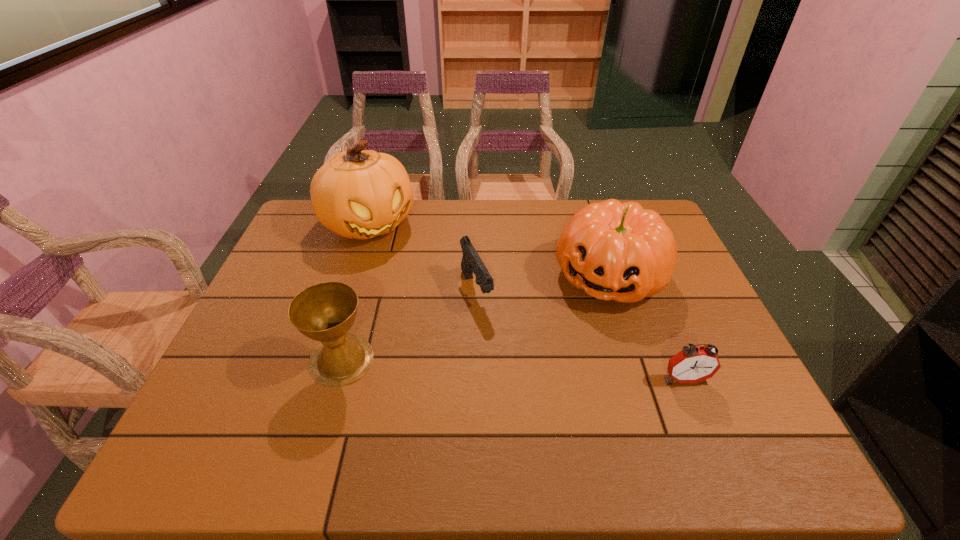
This screenshot has width=960, height=540. Identify the location of free space on the desktop that is between the third shortest object and the alarm clock and is positioned on the front face of the left pumpkin. (490, 368).

The height and width of the screenshot is (540, 960). In order to click on vacant space on the desktop that is between the chalice and the alarm clock and is positioned on the carved face of the shorter pumpkin in this screenshot , I will do `click(560, 372)`.

Where is `free space on the desktop that is between the third shortest object and the alarm clock and is positioned at the barrel of the pistol`? This screenshot has height=540, width=960. free space on the desktop that is between the third shortest object and the alarm clock and is positioned at the barrel of the pistol is located at coordinates (519, 369).